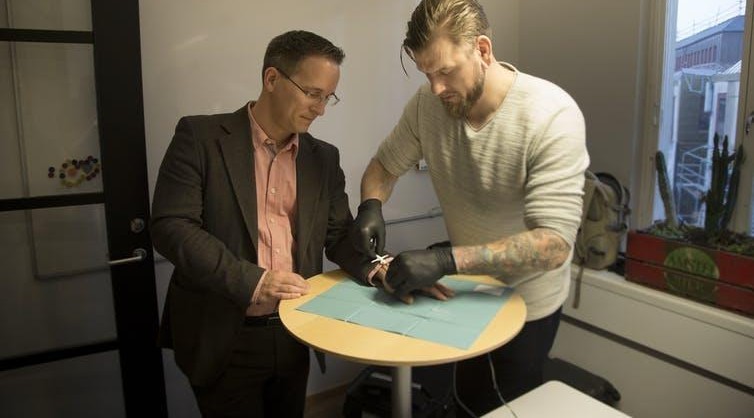
Identify the location of window. The image size is (754, 418). (691, 46).